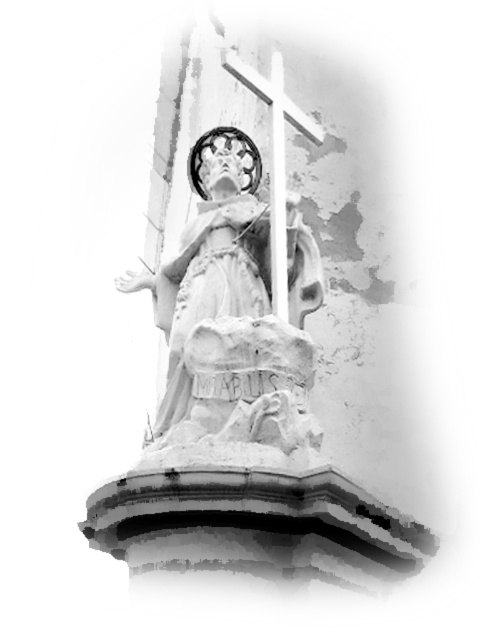
Can you confirm if white stone statue at center is positioned to the left of white smooth cross at center?

Correct, you'll find white stone statue at center to the left of white smooth cross at center.

Based on the photo, who is more distant from viewer, (228, 449) or (278, 164)?

Point (278, 164)

At what (x,y) coordinates should I click in order to perform the action: click on white stone statue at center. Please return your answer as a coordinate pair (x, y). The width and height of the screenshot is (480, 640). Looking at the image, I should click on (233, 321).